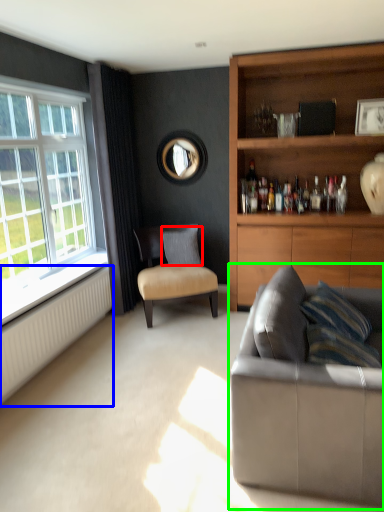
Question: Estimate the real-world distances between objects in this image. Which object is farther from pillow (highlighted by a red box), radiator (highlighted by a blue box) or studio couch (highlighted by a green box)?

Choices:
 (A) radiator
 (B) studio couch

Answer: (B)